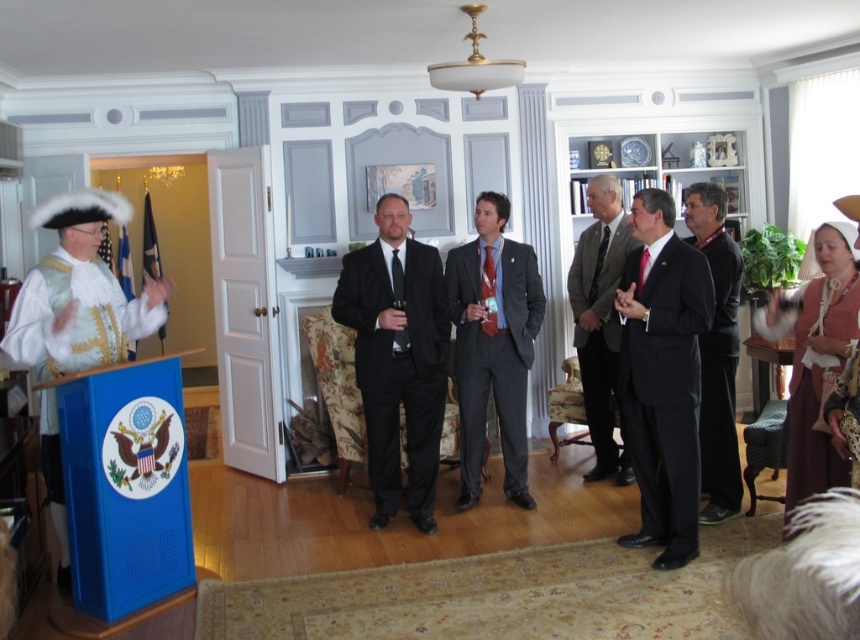
Question: Which object appears farthest from the camera in this image?

Choices:
 (A) black satin suit at center
 (B) gray wool suit at center
 (C) brown satin dress at lower right
 (D) black matte suit at center

Answer: (B)

Question: Does gray wool suit at center appear over dark gray suit at center?

Choices:
 (A) no
 (B) yes

Answer: (A)

Question: Does dark gray suit at center have a larger size compared to brown satin dress at lower right?

Choices:
 (A) yes
 (B) no

Answer: (A)

Question: Among these points, which one is farthest from the camera?

Choices:
 (A) (376, 435)
 (B) (71, 198)

Answer: (A)

Question: Can you confirm if white satin hat at left is positioned to the left of gray wool suit at center?

Choices:
 (A) yes
 (B) no

Answer: (A)

Question: Which of the following is the closest to the observer?

Choices:
 (A) (851, 336)
 (B) (373, 448)
 (C) (516, 346)

Answer: (A)